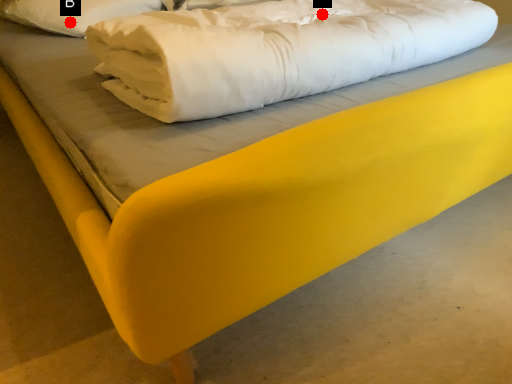
Question: Two points are circled on the image, labeled by A and B beside each circle. Which point is closer to the camera?

Choices:
 (A) A is closer
 (B) B is closer

Answer: (A)